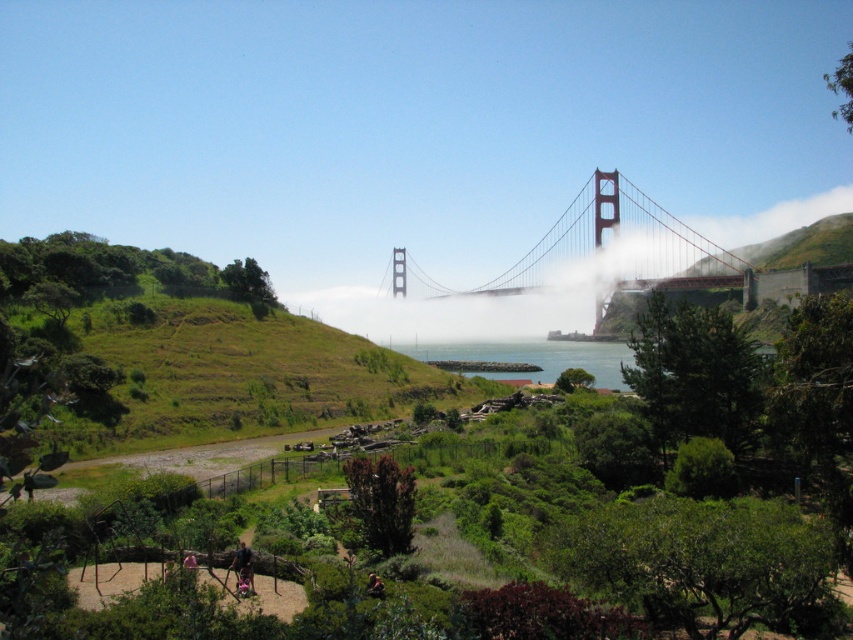
You are standing on a dirt path surrounded by greenery and want to take a photo of the red painted steel suspension bridge at center. If your camera can focus on objects up to 700 feet away, will you be able to capture the bridge clearly?

The distance between you and the red painted steel suspension bridge at center is 693.57 feet, which is within the camera focus range of 700 feet. Therefore, you can capture the bridge clearly.

You are standing on the dirt path near the red painted steel suspension bridge at center and clear blue water at center. Which object is positioned to the right side from your viewpoint?

The red painted steel suspension bridge at center is to the right of the clear blue water at center, so the red painted steel suspension bridge at center is positioned to the right side from your viewpoint.

Based on the photo, you are a photographer planning to take a photo of the red painted steel suspension bridge at center and the clear blue water at center. Based on the scene, which object should you focus on first if you want to capture both in a single shot without moving the camera?

The red painted steel suspension bridge at center is above the clear blue water at center, so you should focus on the bridge first since it is closer to the camera and then ensure the water is in focus as it is further away. However, if using a wide aperture, both might not be in focus simultaneously, requiring a smaller aperture for greater depth of field.